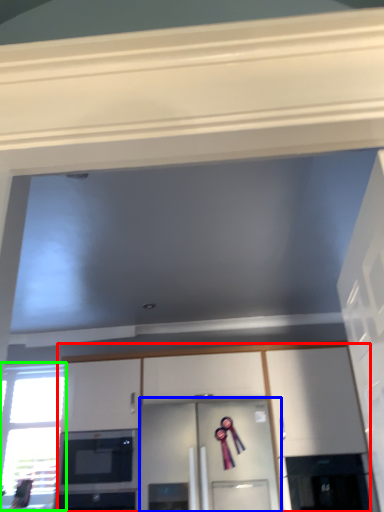
Question: Estimate the real-world distances between objects in this image. Which object is farther from cabinetry (highlighted by a red box), glass door (highlighted by a blue box) or window (highlighted by a green box)?

Choices:
 (A) glass door
 (B) window

Answer: (B)